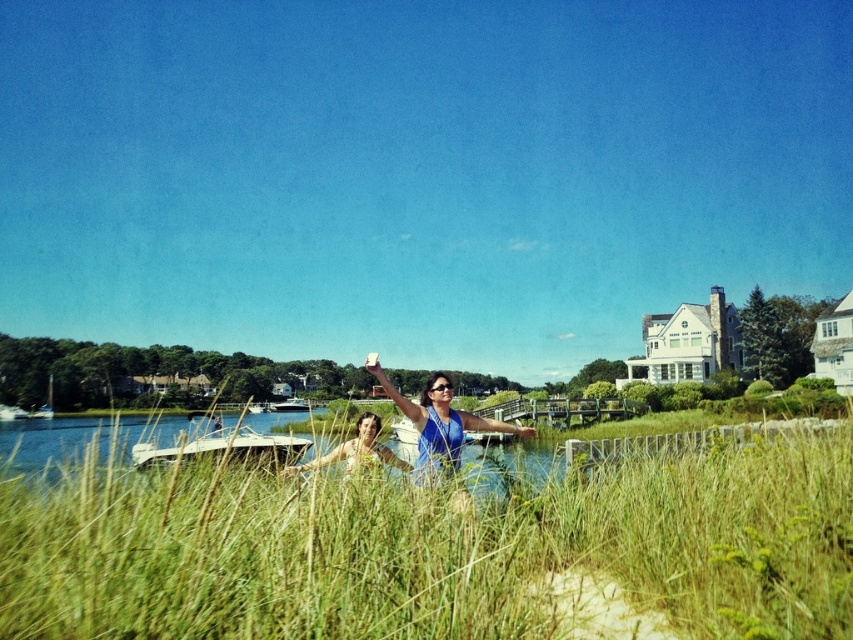
Does matte blue shirt at center have a larger size compared to white glossy boat at center?

Actually, matte blue shirt at center might be smaller than white glossy boat at center.

Is point (375, 440) more distant than point (310, 404)?

That is False.

I want to click on matte blue shirt at center, so click(357, 449).

Can you confirm if white glossy boat at lower left is smaller than white glossy boat at center?

Actually, white glossy boat at lower left might be larger than white glossy boat at center.

Between point (286, 436) and point (286, 397), which one is positioned in front?

Positioned in front is point (286, 436).

Between point (173, 460) and point (294, 403), which one is positioned in front?

Positioned in front is point (173, 460).

Where is `white glossy boat at lower left`? The image size is (853, 640). white glossy boat at lower left is located at coordinates (224, 445).

Can you confirm if green grassy at center is smaller than white glossy boat at lower left?

Correct, green grassy at center occupies less space than white glossy boat at lower left.

Does point (6, 612) come in front of point (260, 449)?

Yes, it is in front of point (260, 449).

Image resolution: width=853 pixels, height=640 pixels. I want to click on green grassy at center, so click(433, 548).